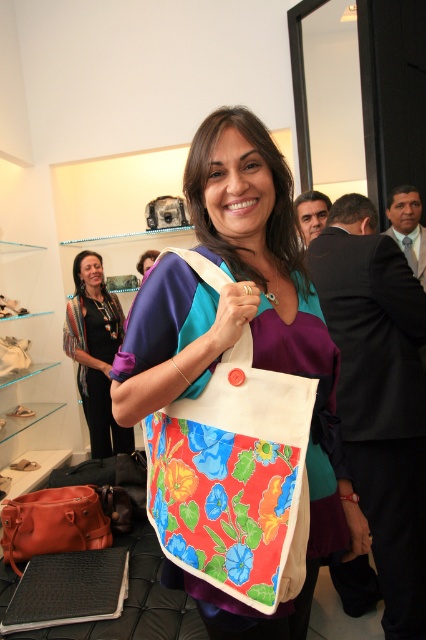
Question: Which point is farther to the camera?

Choices:
 (A) (244, 230)
 (B) (91, 436)
 (C) (106, 532)

Answer: (B)

Question: Does striped fabric dress at left appear on the left side of leather handbag at center?

Choices:
 (A) yes
 (B) no

Answer: (A)

Question: Is floral fabric bag at center smaller than leather handbag at center?

Choices:
 (A) no
 (B) yes

Answer: (A)

Question: Which point appears farthest from the camera in this image?

Choices:
 (A) (89, 381)
 (B) (14, 560)

Answer: (A)

Question: Estimate the real-world distances between objects in this image. Which object is closer to the striped fabric dress at left?

Choices:
 (A) leather handbag at center
 (B) floral fabric bag at center

Answer: (A)

Question: Can you confirm if striped fabric dress at left is thinner than leather handbag at center?

Choices:
 (A) no
 (B) yes

Answer: (A)